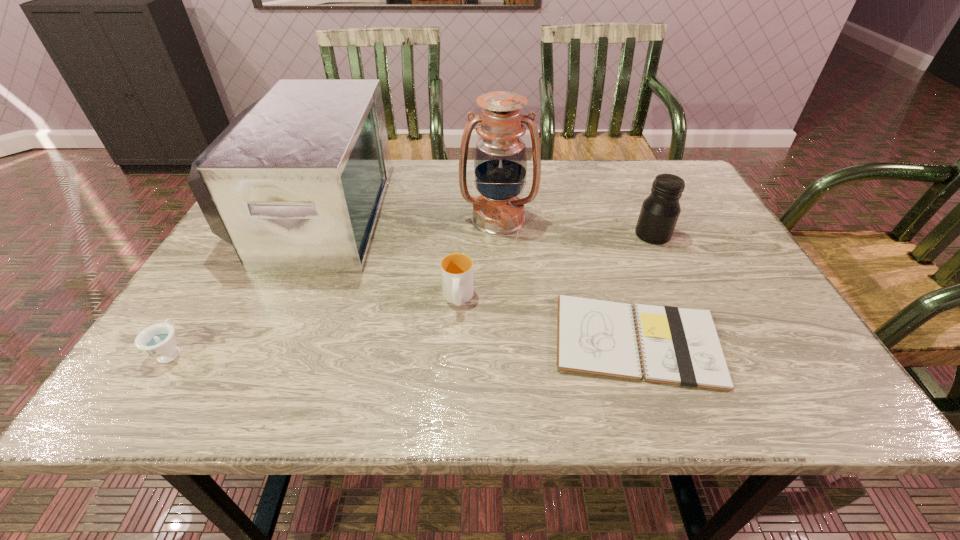
This screenshot has width=960, height=540. What are the coordinates of `free region at the far right corner` in the screenshot? It's located at (633, 161).

Locate an element on the screen. This screenshot has height=540, width=960. free space between the oil lamp and the cup is located at coordinates (478, 259).

Locate an element on the screen. empty location between the teacup and the microwave oven is located at coordinates (244, 282).

Where is `free space between the fifth tallest object and the tallest object`? This screenshot has width=960, height=540. free space between the fifth tallest object and the tallest object is located at coordinates (335, 285).

In order to click on empty space between the fourth tallest object and the notepad in this screenshot , I will do `click(547, 320)`.

Where is `unoccupied position between the notepad and the teacup`? This screenshot has width=960, height=540. unoccupied position between the notepad and the teacup is located at coordinates (404, 346).

Image resolution: width=960 pixels, height=540 pixels. What are the coordinates of `unoccupied area between the tallest object and the second shortest object` in the screenshot? It's located at (335, 285).

The image size is (960, 540). I want to click on free space between the jar and the second shortest object, so click(412, 293).

Where is `vacant area that lies between the jar and the fifth tallest object`? The image size is (960, 540). vacant area that lies between the jar and the fifth tallest object is located at coordinates (412, 293).

At what (x,y) coordinates should I click in order to perform the action: click on vacant area that lies between the cup and the fifth shortest object. Please return your answer as a coordinate pair (x, y). The height and width of the screenshot is (540, 960). Looking at the image, I should click on (387, 256).